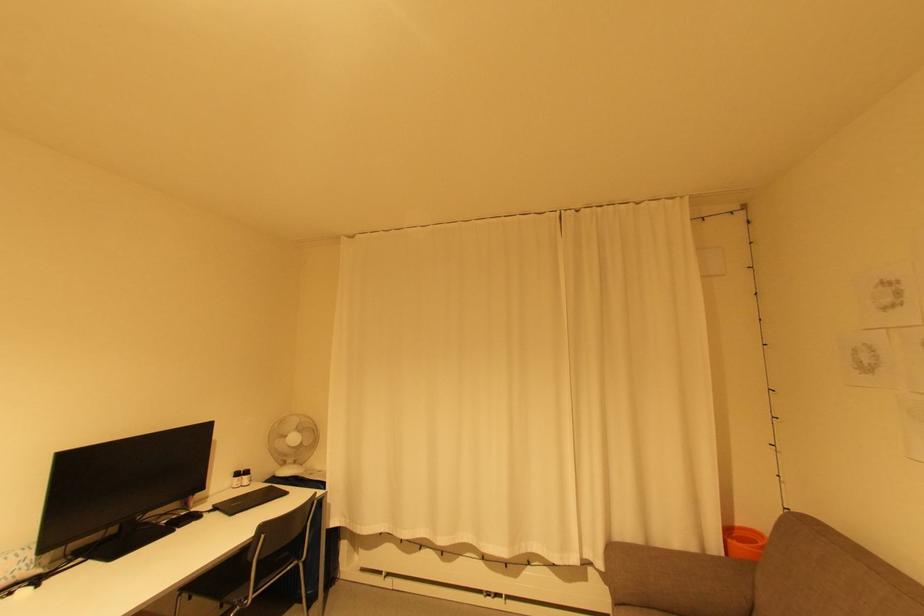
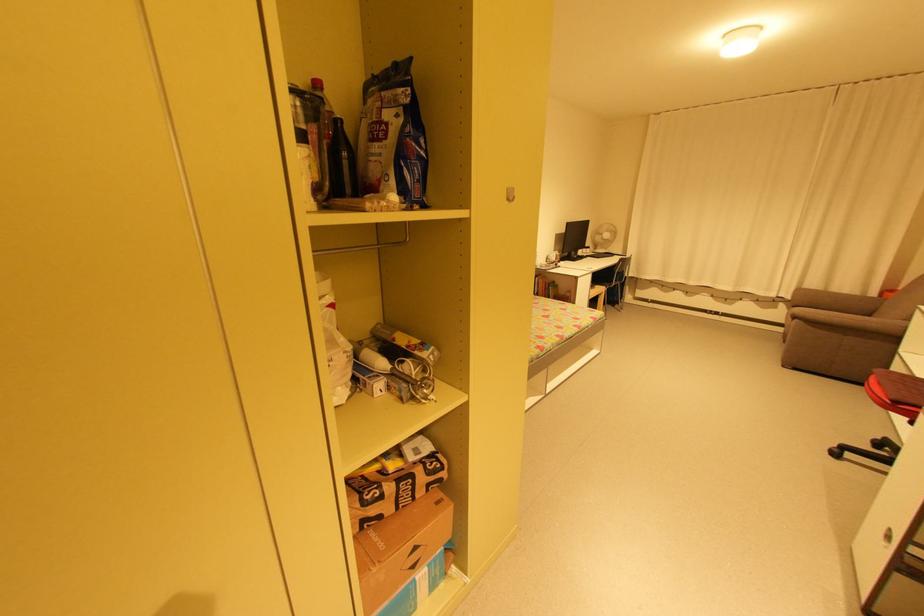
Find the pixel in the second image that matches [250,477] in the first image.

(592, 249)